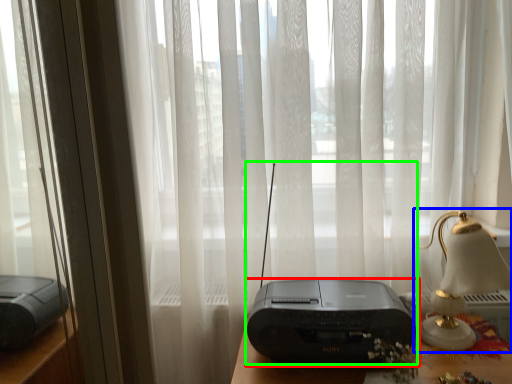
Question: Estimate the real-world distances between objects in this image. Which object is closer to printer (highlighted by a red box), bedside lamp (highlighted by a blue box) or gadget (highlighted by a green box)?

Choices:
 (A) bedside lamp
 (B) gadget

Answer: (B)